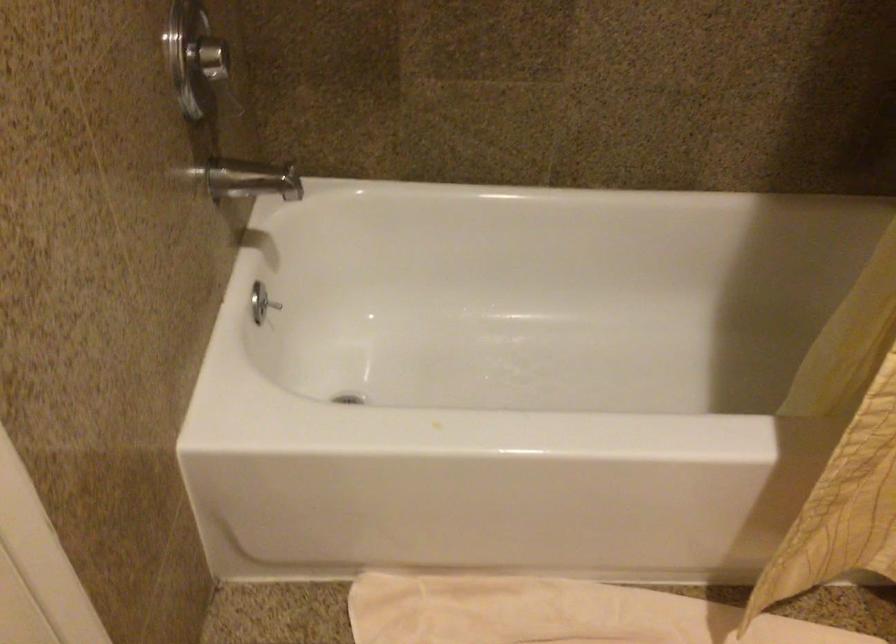
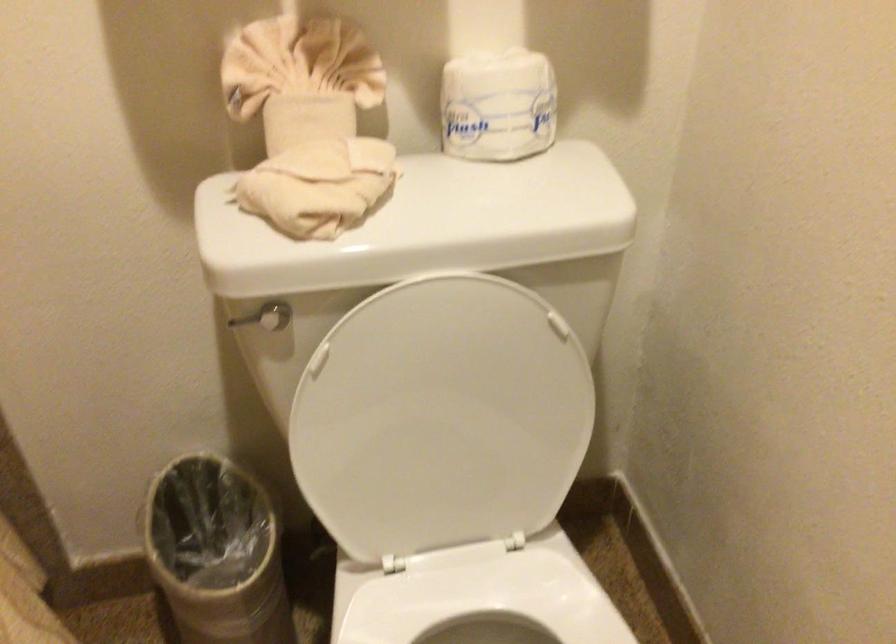
The first image is from the beginning of the video and the second image is from the end. How did the camera likely rotate when shooting the video?

The camera rotated toward right-down.